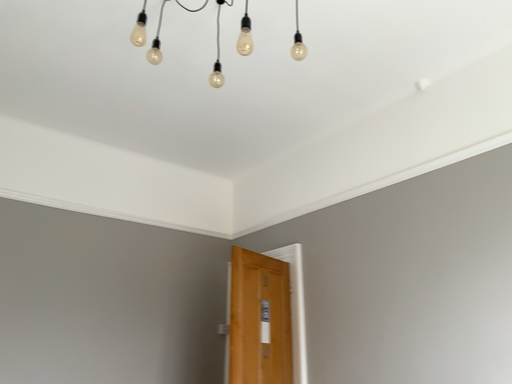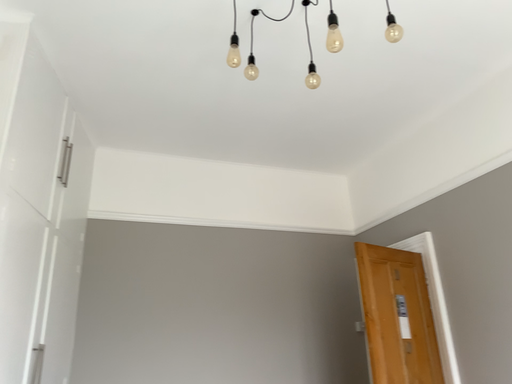
Question: Which way did the camera rotate in the video?

Choices:
 (A) rotated right
 (B) rotated left

Answer: (B)